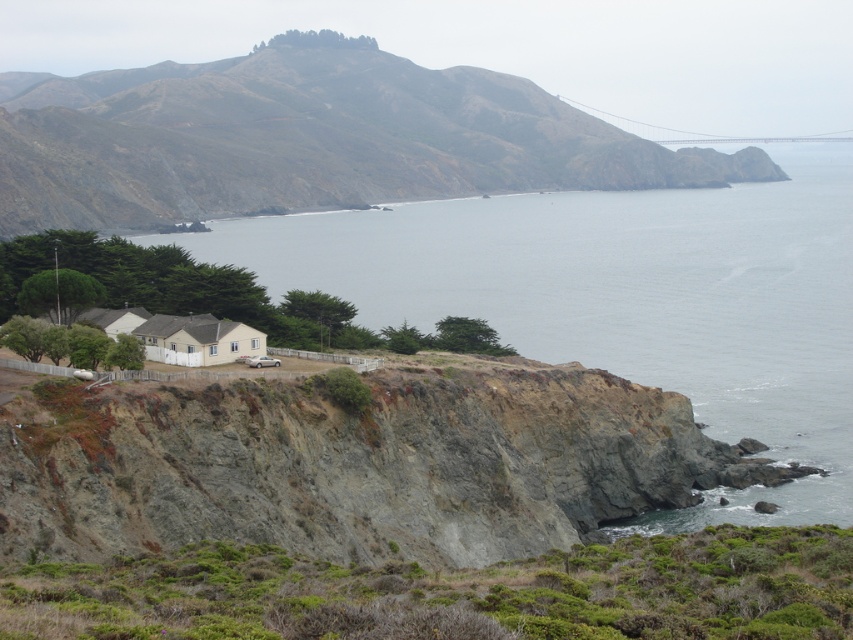
Question: Considering the relative positions of gray water at center and rugged brown cliff at upper left in the image provided, where is gray water at center located with respect to rugged brown cliff at upper left?

Choices:
 (A) right
 (B) left

Answer: (A)

Question: Which of the following is the farthest from the observer?

Choices:
 (A) rugged brown cliff at upper left
 (B) metallic gray bridge at upper right
 (C) gray water at center

Answer: (B)

Question: Does gray water at center have a smaller size compared to metallic gray bridge at upper right?

Choices:
 (A) yes
 (B) no

Answer: (B)

Question: Which is farther from the gray water at center?

Choices:
 (A) rugged brown cliff at upper left
 (B) metallic gray bridge at upper right

Answer: (B)

Question: Which point is closer to the camera?

Choices:
 (A) metallic gray bridge at upper right
 (B) gray water at center

Answer: (B)

Question: Is gray water at center to the right of rugged brown cliff at upper left from the viewer's perspective?

Choices:
 (A) no
 (B) yes

Answer: (B)